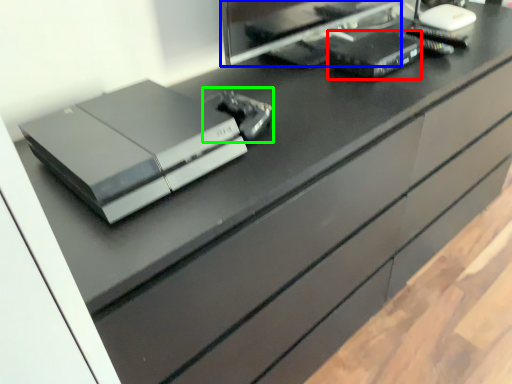
Question: Which is nearer to the equipment (highlighted by a red box)? desktop computer (highlighted by a blue box) or equipment (highlighted by a green box).

Choices:
 (A) desktop computer
 (B) equipment

Answer: (A)